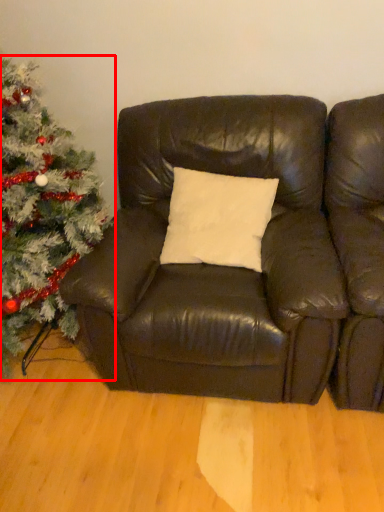
Question: Where is christmas tree (annotated by the red box) located in relation to studio couch in the image?

Choices:
 (A) left
 (B) right

Answer: (A)